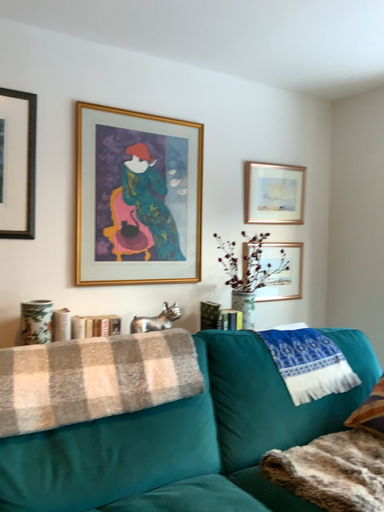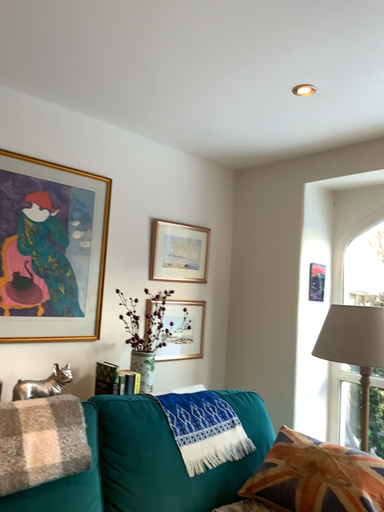
Question: Which way did the camera rotate in the video?

Choices:
 (A) rotated left
 (B) rotated right

Answer: (B)